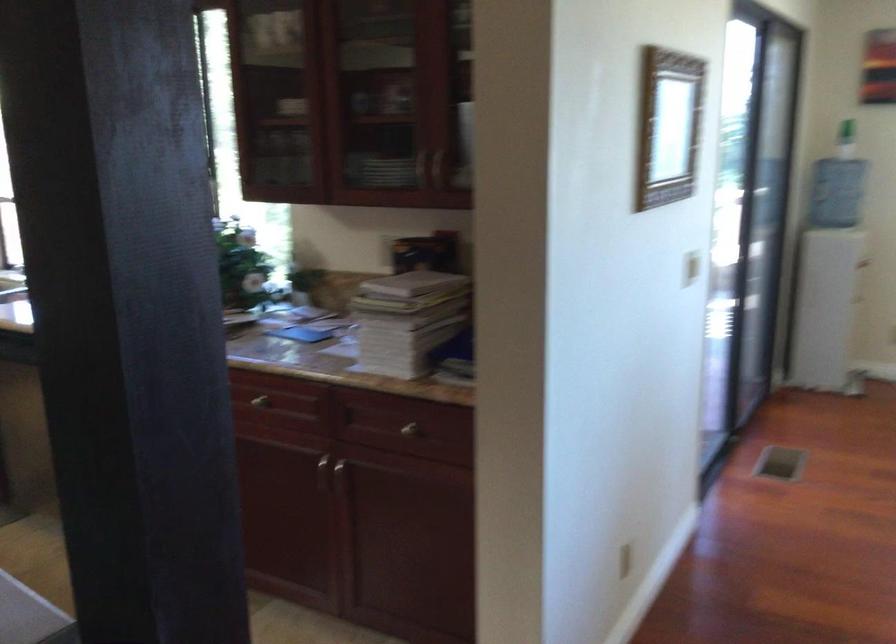
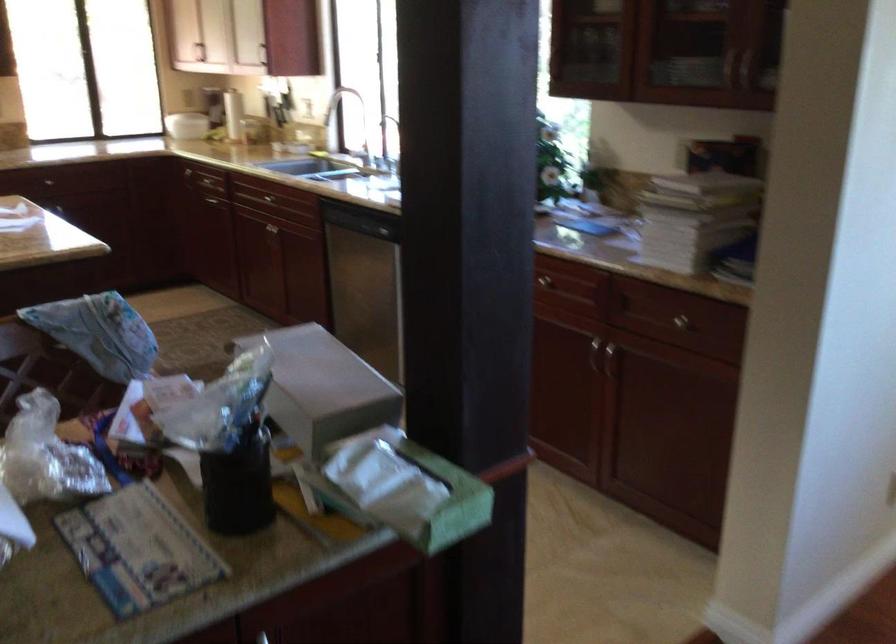
In the second image, find the point that corresponds to the point at 337,478 in the first image.

(610, 361)